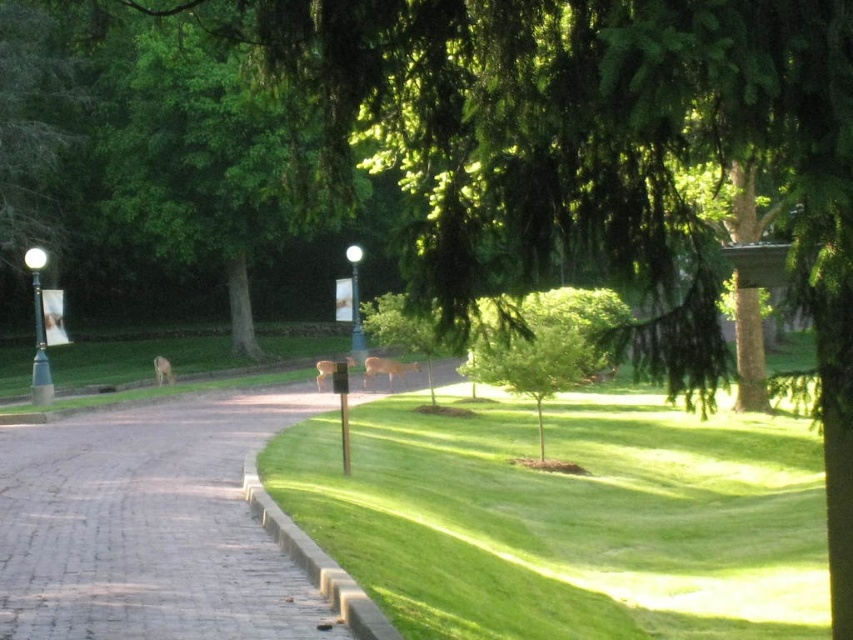
Question: Does brick paved road at center have a smaller size compared to green metallic pole at left?

Choices:
 (A) yes
 (B) no

Answer: (A)

Question: Is green metallic pole at left smaller than white glossy lamp post at center?

Choices:
 (A) yes
 (B) no

Answer: (B)

Question: Is green leafy tree at center positioned in front of green metallic pole at left?

Choices:
 (A) yes
 (B) no

Answer: (A)

Question: Which point is closer to the camera taking this photo?

Choices:
 (A) (425, 490)
 (B) (360, 328)
 (C) (540, 404)

Answer: (A)

Question: Which point is closer to the camera taking this photo?

Choices:
 (A) (42, 259)
 (B) (701, 561)
 (C) (155, 518)

Answer: (C)

Question: Among these objects, which one is farthest from the camera?

Choices:
 (A) green leafy tree at center
 (B) brick paved road at center
 (C) green grass at center
 (D) green metallic pole at left

Answer: (D)